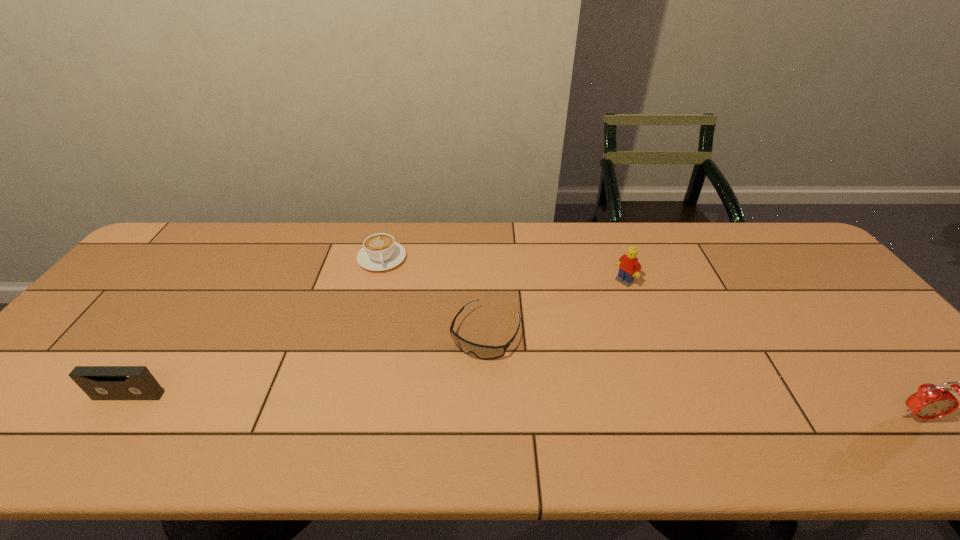
Identify the location of the third shortest object. (99, 382).

The width and height of the screenshot is (960, 540). What are the coordinates of `videotape` in the screenshot? It's located at (99, 382).

The image size is (960, 540). Find the location of `the rightmost object`. the rightmost object is located at coordinates (930, 402).

This screenshot has width=960, height=540. Find the location of `the nearest object`. the nearest object is located at coordinates pyautogui.click(x=930, y=402).

Locate an element on the screen. This screenshot has width=960, height=540. the third object from left to right is located at coordinates (485, 352).

You are a GUI agent. You are given a task and a screenshot of the screen. Output one action in this format:
    pyautogui.click(x=<x>, y=<y>)
    Task: Click on the goggles
    
    Given the screenshot: What is the action you would take?
    pyautogui.click(x=485, y=352)

At what (x,y) coordinates should I click in order to perform the action: click on the second object from right to left. Please return your answer as a coordinate pair (x, y). This screenshot has width=960, height=540. Looking at the image, I should click on (629, 267).

Where is `cappuccino`? This screenshot has width=960, height=540. cappuccino is located at coordinates click(380, 252).

The width and height of the screenshot is (960, 540). What are the coordinates of `free location located 0.110m on the lenses of the goggles` in the screenshot? It's located at (451, 395).

The image size is (960, 540). Find the location of `free space located on the lenses of the goggles`. free space located on the lenses of the goggles is located at coordinates (463, 375).